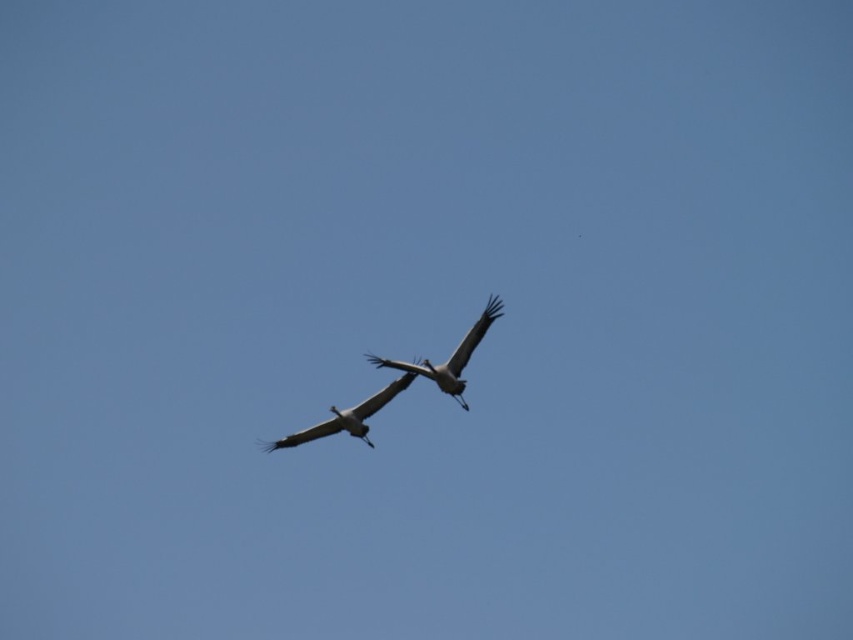
You are a drone operator trying to locate a specific point in the sky. You see a gray matte bird at center and a gray matte bird at center. Which bird is the point at location (450, 356) on?

The point at location (450, 356) is on the gray matte bird at center.

You are a photographer aiming to capture the perfect shot of the gray matte bird at center. Based on its position in the frame, what are the exact coordinates where you should focus your camera?

The gray matte bird at center is located at coordinates (450, 356), so you should focus your camera precisely at those coordinates to capture it accurately.